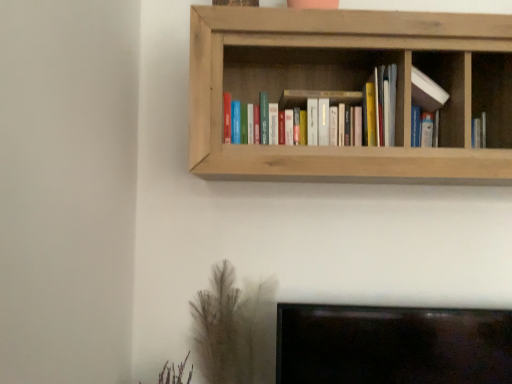
Question: From a real-world perspective, does white matte bookshelf at upper center sit lower than natural wood bookshelf at upper center?

Choices:
 (A) yes
 (B) no

Answer: (A)

Question: Does white matte bookshelf at upper center come behind natural wood bookshelf at upper center?

Choices:
 (A) no
 (B) yes

Answer: (B)

Question: Does white matte bookshelf at upper center appear on the left side of natural wood bookshelf at upper center?

Choices:
 (A) no
 (B) yes

Answer: (A)

Question: Is white matte bookshelf at upper center completely or partially outside of natural wood bookshelf at upper center?

Choices:
 (A) no
 (B) yes

Answer: (A)

Question: Is white matte bookshelf at upper center with natural wood bookshelf at upper center?

Choices:
 (A) no
 (B) yes

Answer: (A)

Question: From the image's perspective, is matte wooden bookshelf at center located above or below natural wood bookshelf at upper center?

Choices:
 (A) below
 (B) above

Answer: (A)

Question: In the image, is matte wooden bookshelf at center on the left side or the right side of natural wood bookshelf at upper center?

Choices:
 (A) right
 (B) left

Answer: (B)

Question: Is matte wooden bookshelf at center wider or thinner than natural wood bookshelf at upper center?

Choices:
 (A) wide
 (B) thin

Answer: (B)

Question: Based on their sizes in the image, would you say matte wooden bookshelf at center is bigger or smaller than natural wood bookshelf at upper center?

Choices:
 (A) small
 (B) big

Answer: (A)

Question: Is natural wood bookshelf at upper center to the left or to the right of brown textured plant at lower left in the image?

Choices:
 (A) left
 (B) right

Answer: (B)

Question: From the image's perspective, is natural wood bookshelf at upper center above or below brown textured plant at lower left?

Choices:
 (A) above
 (B) below

Answer: (A)

Question: Is natural wood bookshelf at upper center taller or shorter than brown textured plant at lower left?

Choices:
 (A) short
 (B) tall

Answer: (B)

Question: In the image, is natural wood bookshelf at upper center positioned in front of or behind brown textured plant at lower left?

Choices:
 (A) front
 (B) behind

Answer: (A)

Question: Is brown textured plant at lower left inside or outside of matte wooden bookshelf at center?

Choices:
 (A) outside
 (B) inside

Answer: (A)

Question: Is point (215, 365) closer or farther from the camera than point (437, 107)?

Choices:
 (A) farther
 (B) closer

Answer: (A)